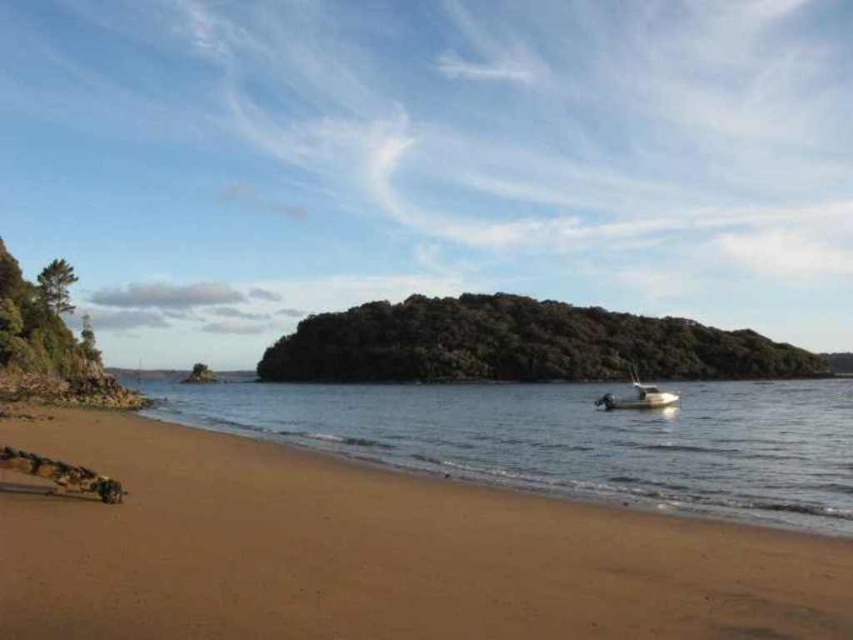
Question: Is clear water at center to the right of green leafy island at center from the viewer's perspective?

Choices:
 (A) no
 (B) yes

Answer: (A)

Question: Does clear water at center lie in front of white plastic boat at lower right?

Choices:
 (A) no
 (B) yes

Answer: (B)

Question: Which point is farther to the camera?

Choices:
 (A) green leafy island at center
 (B) white plastic boat at lower right
 (C) sandy beach at lower left

Answer: (A)

Question: Among these objects, which one is farthest from the camera?

Choices:
 (A) sandy beach at lower left
 (B) white plastic boat at lower right
 (C) green leafy island at center

Answer: (C)

Question: Does clear water at center have a larger size compared to green leafy island at center?

Choices:
 (A) yes
 (B) no

Answer: (A)

Question: Among these points, which one is nearest to the camera?

Choices:
 (A) (659, 392)
 (B) (367, 416)
 (C) (310, 337)

Answer: (B)